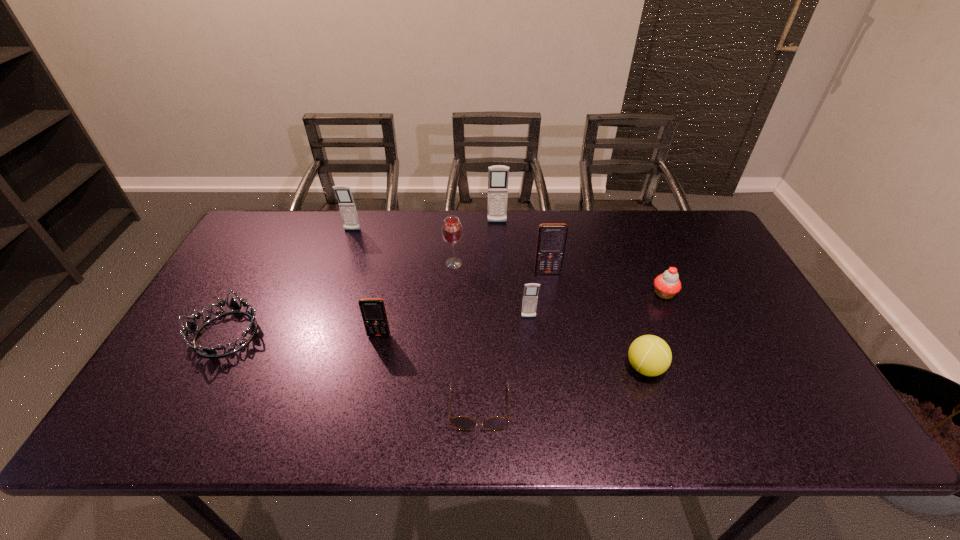
Image resolution: width=960 pixels, height=540 pixels. Identify the location of the farthest cellular telephone. (498, 175).

This screenshot has width=960, height=540. Identify the location of the third cellular telephone from left to right. (498, 175).

Identify the location of the ninth object from right to left. The height and width of the screenshot is (540, 960). (343, 193).

Image resolution: width=960 pixels, height=540 pixels. In order to click on the leftmost cellular telephone in this screenshot , I will do `click(343, 193)`.

Image resolution: width=960 pixels, height=540 pixels. Find the location of `the right orange cellular telephone`. the right orange cellular telephone is located at coordinates (551, 240).

I want to click on the eighth object from left to right, so click(551, 240).

Find the location of a particular element. The image size is (960, 540). red wineglass is located at coordinates (452, 231).

Locate an element on the screen. The height and width of the screenshot is (540, 960). the nearer orange cellular telephone is located at coordinates (373, 311).

Where is `the third object from left to right`? the third object from left to right is located at coordinates (373, 311).

Where is `the fourth farthest cellular telephone`? the fourth farthest cellular telephone is located at coordinates (530, 296).